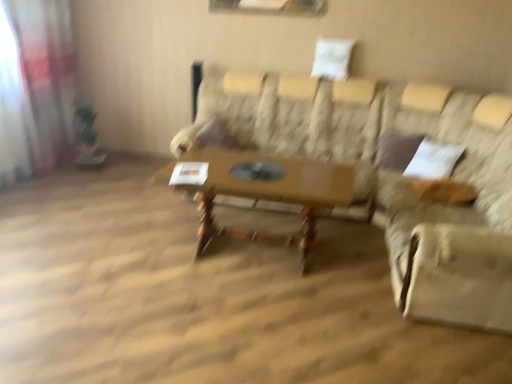
Question: Considering the positions of patterned fabric couch at center and translucent fabric curtain at left in the image, is patterned fabric couch at center bigger or smaller than translucent fabric curtain at left?

Choices:
 (A) small
 (B) big

Answer: (B)

Question: From a real-world perspective, is patterned fabric couch at center above or below translucent fabric curtain at left?

Choices:
 (A) below
 (B) above

Answer: (A)

Question: Considering the real-world distances, which object is farthest from the translucent fabric curtain at left?

Choices:
 (A) patterned fabric couch at center
 (B) beige fabric swivel chair at right
 (C) wooden table at center

Answer: (B)

Question: Considering the real-world distances, which object is farthest from the translucent fabric curtain at left?

Choices:
 (A) patterned fabric couch at center
 (B) wooden table at center
 (C) beige fabric swivel chair at right

Answer: (C)